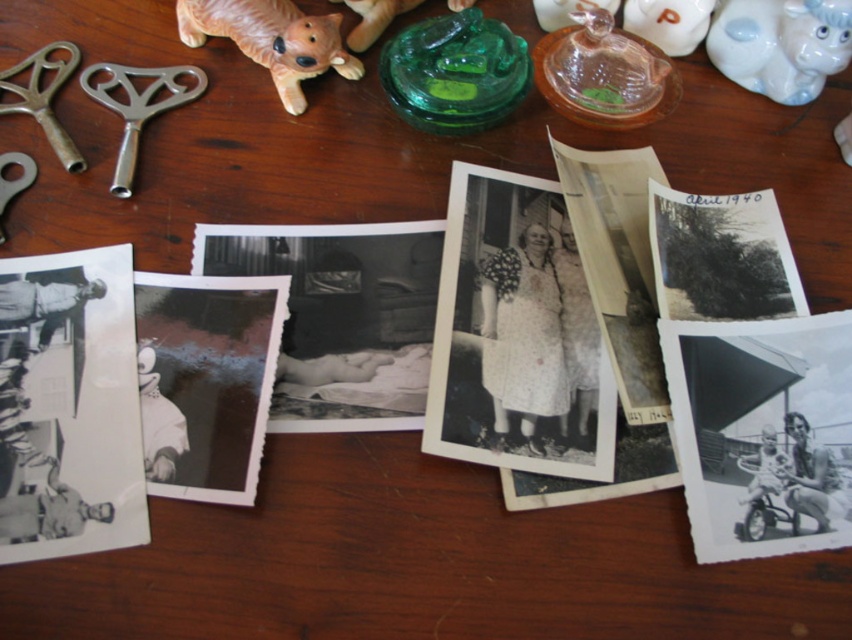
You are organizing items on a table and need to place a new item between the orange plastic dog at upper left and the translucent glass jar at upper center. Based on their positions, where should you place the new item?

The new item should be placed between the orange plastic dog at upper left and the translucent glass jar at upper center, to the right of the orange plastic dog at upper left and to the left of the translucent glass jar at upper center since the orange plastic dog at upper left is positioned to the left of the translucent glass jar at upper center.

You are organizing items on a table and need to place a new item between the translucent glass jar at upper center and the transparent glass figurine at upper center. Is there enough space between them to fit a small key?

The translucent glass jar at upper center is positioned on the right side of the transparent glass figurine at upper center, so there is space between them. However, the description does not provide specific measurements, so it is uncertain if the space is sufficient for a small key.

You are organizing items on a wooden table and need to place a new item between the orange plastic dog at upper left and the translucent glass jar at upper center. Based on their positions, which item should the new item be placed closer to?

The new item should be placed closer to the translucent glass jar at upper center because the orange plastic dog at upper left is closer to the viewer, meaning the jar is further away, so placing the new item closer to the jar would maintain the spatial arrangement.